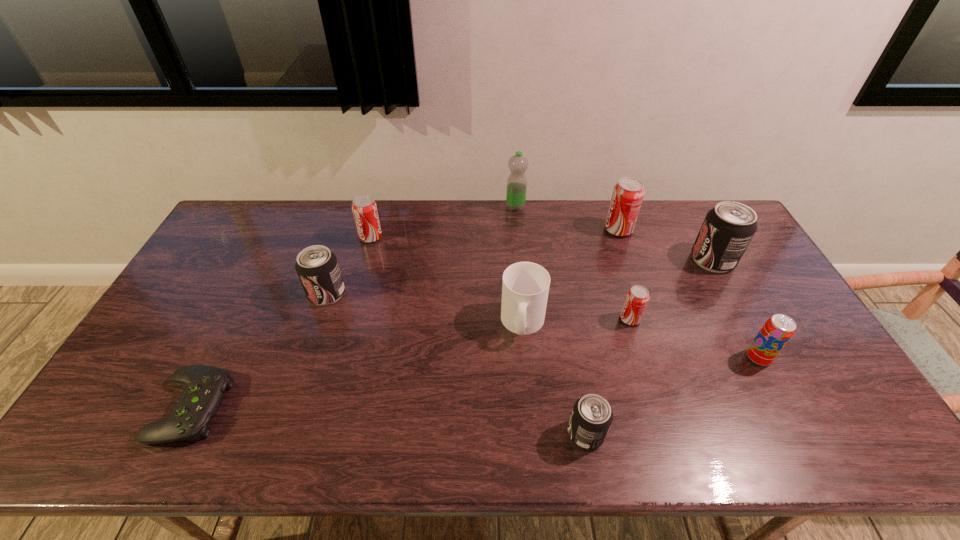
Choose which object is the ninth nearest neighbor to the control. Please provide its 2D coordinates. Your answer should be formatted as a tuple, i.e. [(x, y)], where the tuple contains the x and y coordinates of a point satisfying the conditions above.

[(728, 228)]

Identify which soda can is located as the fifth nearest to the biggest black soda can. Please provide its 2D coordinates. Your answer should be formatted as a tuple, i.e. [(x, y)], where the tuple contains the x and y coordinates of a point satisfying the conditions above.

[(364, 208)]

Identify which soda can is the seventh closest to the farthest object. Please provide its 2D coordinates. Your answer should be formatted as a tuple, i.e. [(x, y)], where the tuple contains the x and y coordinates of a point satisfying the conditions above.

[(777, 331)]

Locate which red soda can ranks in proximity to the smallest red soda can. Please provide its 2D coordinates. Your answer should be formatted as a tuple, i.e. [(x, y)], where the tuple contains the x and y coordinates of a point satisfying the conditions above.

[(628, 193)]

Where is `red soda can identified as the closest to the control`? red soda can identified as the closest to the control is located at coordinates (364, 208).

You are a GUI agent. You are given a task and a screenshot of the screen. Output one action in this format:
    pyautogui.click(x=<x>, y=<y>)
    Task: Click on the second closest black soda can relative to the smallest black soda can
    Image resolution: width=960 pixels, height=540 pixels.
    Given the screenshot: What is the action you would take?
    pyautogui.click(x=317, y=267)

Where is `black soda can that is the second closest to the fourth nearest soda can`? black soda can that is the second closest to the fourth nearest soda can is located at coordinates (728, 228).

Where is `vacant space that satisfies the following two spatial constraints: 1. on the logo side of the leftmost red soda can; 2. on the left side of the seventh nearest object`? The image size is (960, 540). vacant space that satisfies the following two spatial constraints: 1. on the logo side of the leftmost red soda can; 2. on the left side of the seventh nearest object is located at coordinates (365, 260).

At what (x,y) coordinates should I click in order to perform the action: click on free space in the image that satisfies the following two spatial constraints: 1. on the logo side of the biggest red soda can; 2. on the back side of the eighth farthest object. Please return your answer as a coordinate pair (x, y). The height and width of the screenshot is (540, 960). Looking at the image, I should click on (663, 357).

Identify the location of vacant point that satisfies the following two spatial constraints: 1. on the logo side of the smallest red soda can; 2. on the back side of the sixth farthest soda can. This screenshot has height=540, width=960. (642, 357).